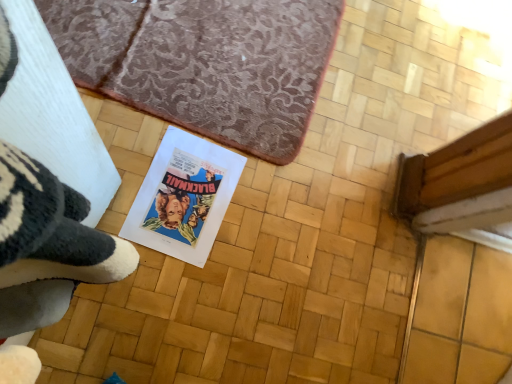
At what (x,y) coordinates should I click in order to perform the action: click on free point above brown textured rug at upper center (from a real-world perspective). Please return your answer as a coordinate pair (x, y). The width and height of the screenshot is (512, 384). Looking at the image, I should click on (200, 43).